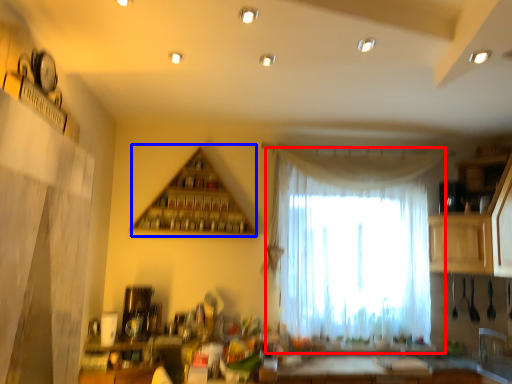
Question: Which of the following is the farthest to the observer, curtain (highlighted by a red box) or shelf (highlighted by a blue box)?

Choices:
 (A) curtain
 (B) shelf

Answer: (A)